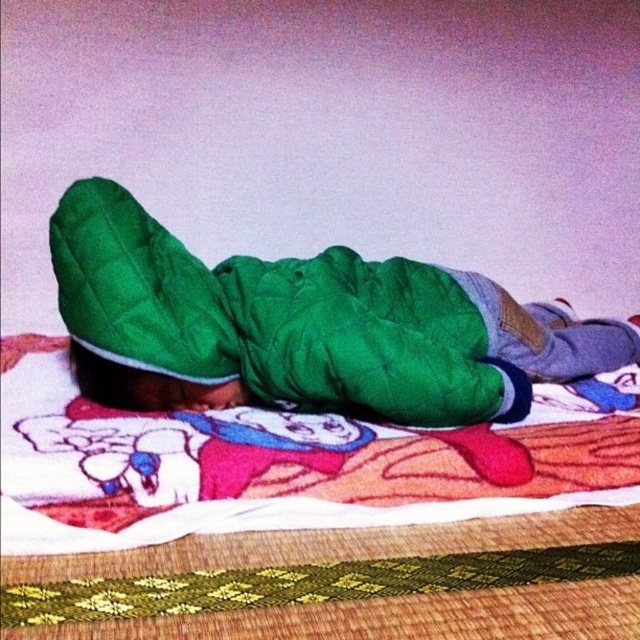
Question: Which point is farther to the camera?

Choices:
 (A) green quilted fabric at center
 (B) green quilted jacket at center

Answer: (A)

Question: Which point appears closest to the camera in this image?

Choices:
 (A) (154, 408)
 (B) (170, 330)

Answer: (B)

Question: Can you confirm if green quilted jacket at center is positioned above green quilted fabric at center?

Choices:
 (A) yes
 (B) no

Answer: (A)

Question: Can you confirm if green quilted jacket at center is positioned below green quilted fabric at center?

Choices:
 (A) no
 (B) yes

Answer: (A)

Question: Among these points, which one is farthest from the camera?

Choices:
 (A) (134, 378)
 (B) (436, 282)

Answer: (B)

Question: Is green quilted jacket at center smaller than green quilted fabric at center?

Choices:
 (A) no
 (B) yes

Answer: (A)